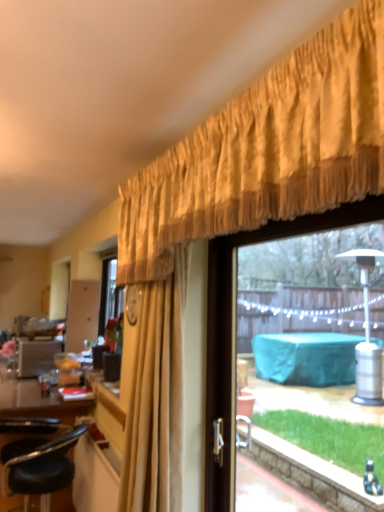
Question: Considering the relative sizes of black leather stool at lower left and gold textured curtain at upper center in the image provided, is black leather stool at lower left shorter than gold textured curtain at upper center?

Choices:
 (A) no
 (B) yes

Answer: (B)

Question: Are black leather stool at lower left and gold textured curtain at upper center making contact?

Choices:
 (A) no
 (B) yes

Answer: (A)

Question: Considering the relative sizes of black leather stool at lower left and gold textured curtain at upper center in the image provided, is black leather stool at lower left wider than gold textured curtain at upper center?

Choices:
 (A) yes
 (B) no

Answer: (A)

Question: Can you confirm if black leather stool at lower left is bigger than gold textured curtain at upper center?

Choices:
 (A) no
 (B) yes

Answer: (B)

Question: Is black leather stool at lower left oriented towards gold textured curtain at upper center?

Choices:
 (A) yes
 (B) no

Answer: (B)

Question: Can you confirm if black leather stool at lower left is positioned to the right of gold textured curtain at upper center?

Choices:
 (A) yes
 (B) no

Answer: (B)

Question: Is transparent glass window at upper right smaller than black leather stool at lower left?

Choices:
 (A) no
 (B) yes

Answer: (B)

Question: Is transparent glass window at upper right not within black leather stool at lower left?

Choices:
 (A) no
 (B) yes

Answer: (B)

Question: Is transparent glass window at upper right further to camera compared to black leather stool at lower left?

Choices:
 (A) no
 (B) yes

Answer: (A)

Question: Can you confirm if transparent glass window at upper right is shorter than black leather stool at lower left?

Choices:
 (A) yes
 (B) no

Answer: (B)

Question: Is transparent glass window at upper right thinner than black leather stool at lower left?

Choices:
 (A) yes
 (B) no

Answer: (A)

Question: From a real-world perspective, is transparent glass window at upper right physically above black leather stool at lower left?

Choices:
 (A) yes
 (B) no

Answer: (A)

Question: Is black leather stool at lower left not close to transparent glass window at upper right?

Choices:
 (A) no
 (B) yes

Answer: (B)